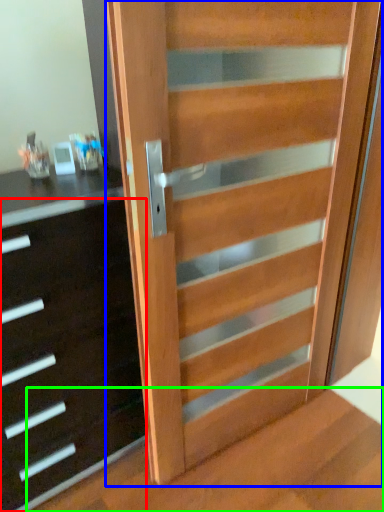
Question: Estimate the real-world distances between objects in this image. Which object is farther from chest of drawers (highlighted by a red box), door (highlighted by a blue box) or stairwell (highlighted by a green box)?

Choices:
 (A) door
 (B) stairwell

Answer: (B)